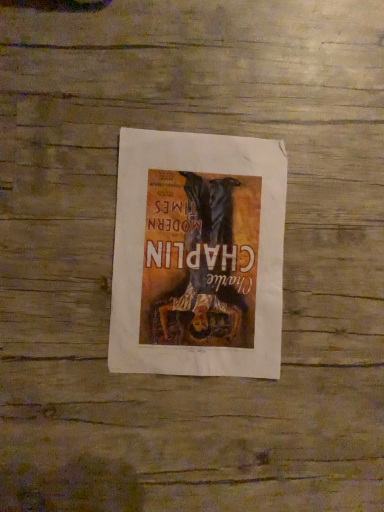
In order to click on white paper poster at center in this screenshot , I will do `click(198, 255)`.

What do you see at coordinates (198, 255) in the screenshot? I see `white paper poster at center` at bounding box center [198, 255].

Identify the location of white paper poster at center. Image resolution: width=384 pixels, height=512 pixels. (198, 255).